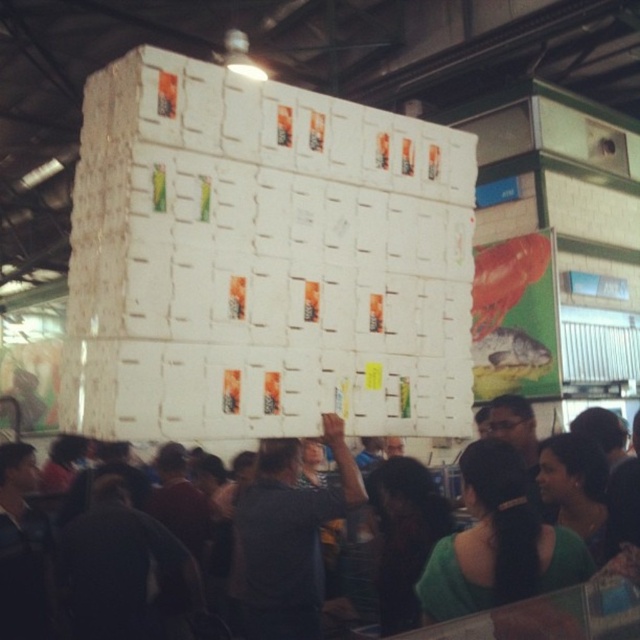
Question: From the image, what is the correct spatial relationship of dark gray fabric shirt at center in relation to matte white boxes at center?

Choices:
 (A) right
 (B) left

Answer: (B)

Question: Where is dark gray fabric shirt at center located in relation to matte white boxes at center in the image?

Choices:
 (A) right
 (B) left

Answer: (B)

Question: Is dark gray fabric shirt at center positioned before matte white boxes at center?

Choices:
 (A) yes
 (B) no

Answer: (B)

Question: Among these objects, which one is nearest to the camera?

Choices:
 (A) matte white boxes at center
 (B) dark gray fabric shirt at center

Answer: (A)

Question: Among these objects, which one is farthest from the camera?

Choices:
 (A) dark gray fabric shirt at center
 (B) matte white boxes at center

Answer: (A)

Question: Which object is farther from the camera taking this photo?

Choices:
 (A) matte white boxes at center
 (B) dark gray fabric shirt at center

Answer: (B)